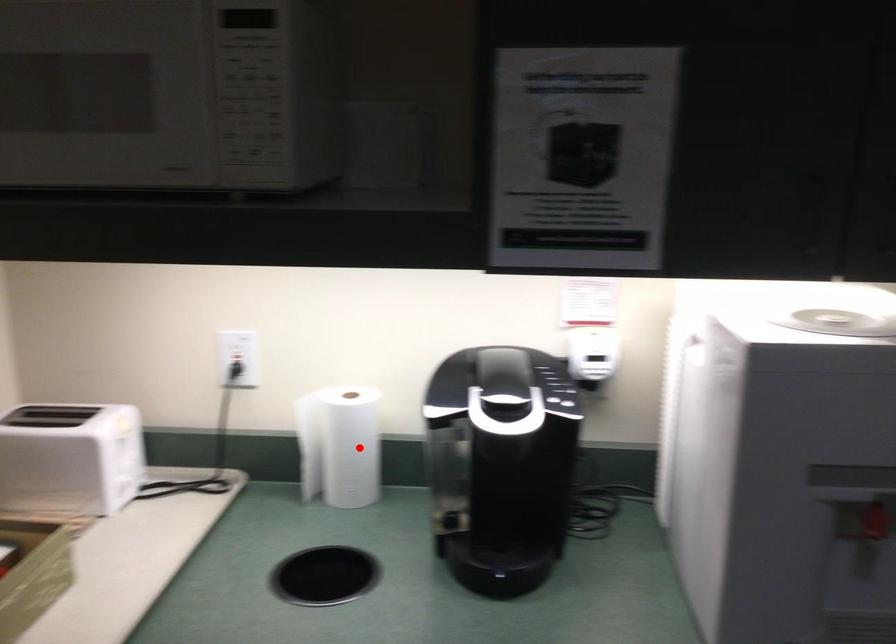
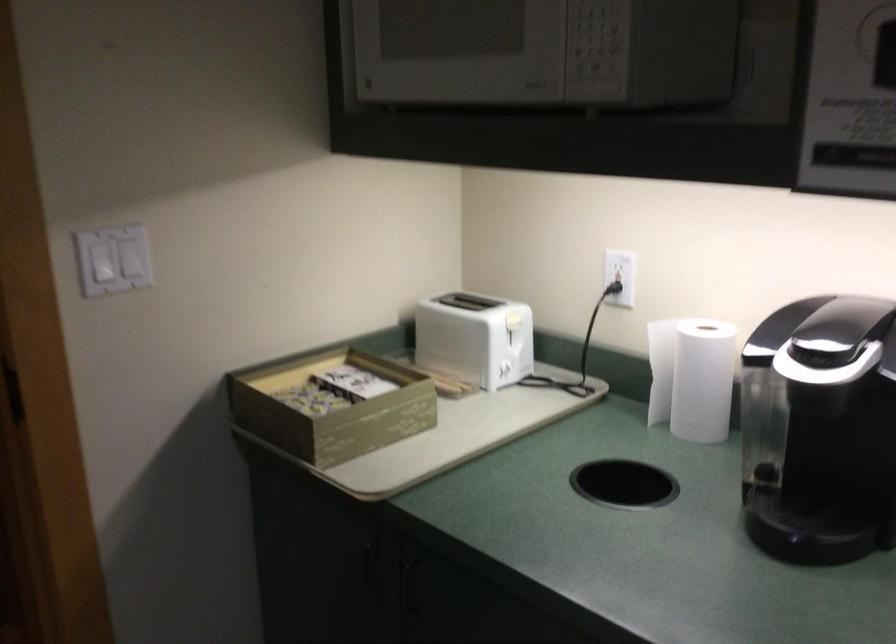
Locate, in the second image, the point that corresponds to the highlighted location in the first image.

(702, 380)